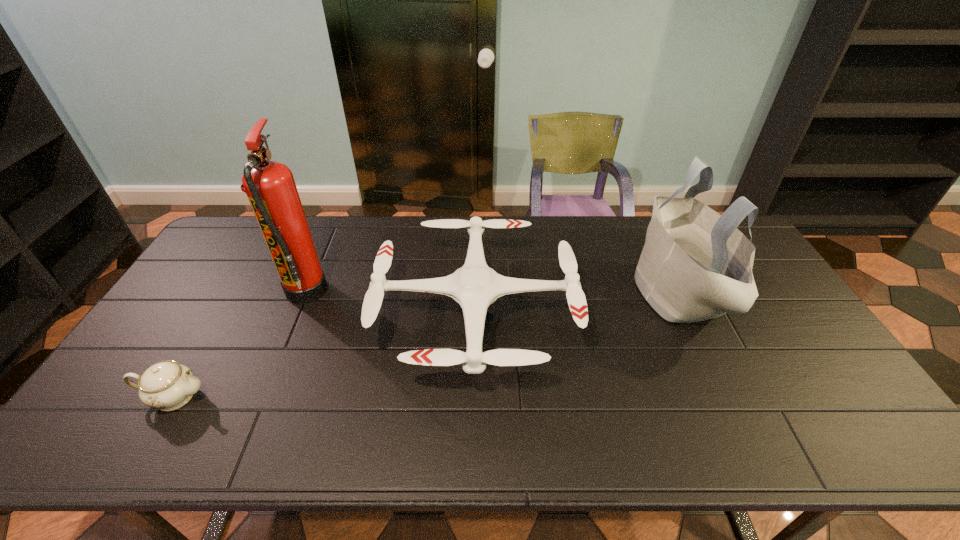
Locate an element on the screen. The height and width of the screenshot is (540, 960). the third closest object to the rightmost object is located at coordinates (167, 385).

You are a GUI agent. You are given a task and a screenshot of the screen. Output one action in this format:
    pyautogui.click(x=<x>, y=<y>)
    Task: Click on the third closest object to the second shortest object
    The height and width of the screenshot is (540, 960).
    Given the screenshot: What is the action you would take?
    pyautogui.click(x=167, y=385)

Where is `vacant space that satisfies the following two spatial constraints: 1. with the nozzle pointing from the back of the fire extinguisher; 2. on the right side of the rightmost object`? The width and height of the screenshot is (960, 540). vacant space that satisfies the following two spatial constraints: 1. with the nozzle pointing from the back of the fire extinguisher; 2. on the right side of the rightmost object is located at coordinates (304, 293).

Locate an element on the screen. This screenshot has width=960, height=540. free spot that satisfies the following two spatial constraints: 1. with the nozzle pointing from the back of the second object from left to right; 2. on the back side of the shopping bag is located at coordinates pos(304,293).

Locate an element on the screen. This screenshot has width=960, height=540. free space that satisfies the following two spatial constraints: 1. with the nozzle pointing from the back of the second object from left to right; 2. on the back side of the shopping bag is located at coordinates (304, 293).